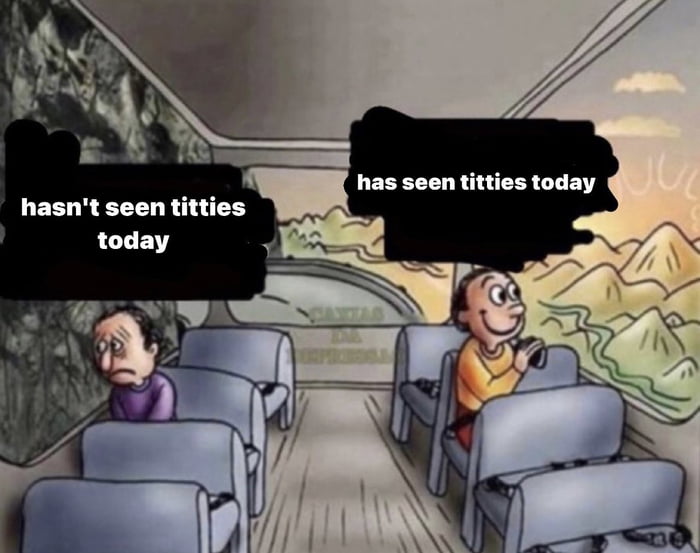
The width and height of the screenshot is (700, 553). What are the coordinates of `gloomy wall` in the screenshot? It's located at (113, 106), (43, 375).